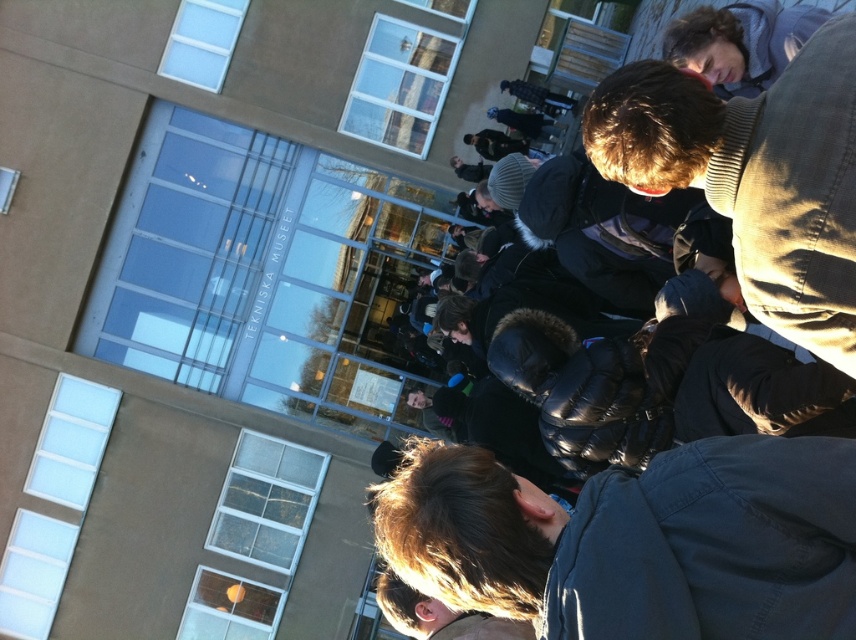
Question: Which point is farther to the camera?

Choices:
 (A) dark blue jacket at center
 (B) dark brown sweater at center

Answer: (B)

Question: Is dark brown hair at lower center thinner than matte black backpack at upper center?

Choices:
 (A) no
 (B) yes

Answer: (A)

Question: Among these objects, which one is nearest to the camera?

Choices:
 (A) dark brown hair at upper right
 (B) dark blue jacket at center
 (C) dark brown sweater at center
 (D) blonde hair at lower center

Answer: (B)

Question: Does dark brown sweater at center appear over dark brown hair at upper right?

Choices:
 (A) no
 (B) yes

Answer: (A)

Question: Where is dark blue jacket at center located in relation to dark brown hair at upper right in the image?

Choices:
 (A) below
 (B) above

Answer: (A)

Question: Estimate the real-world distances between objects in this image. Which object is farther from the dark blue jacket at center?

Choices:
 (A) matte black backpack at upper center
 (B) dark brown hair at lower center
 (C) dark brown sweater at center
 (D) dark brown hair at upper right

Answer: (A)